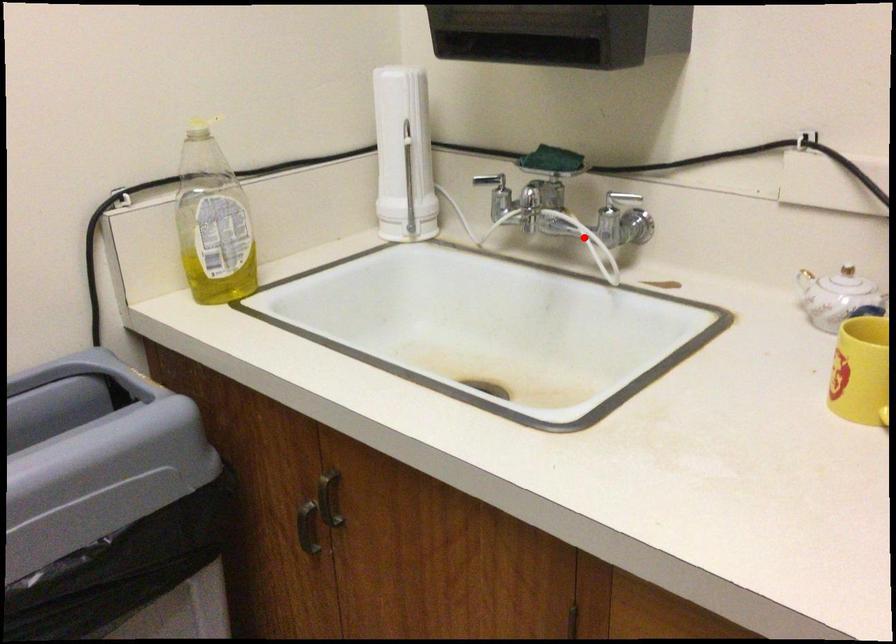
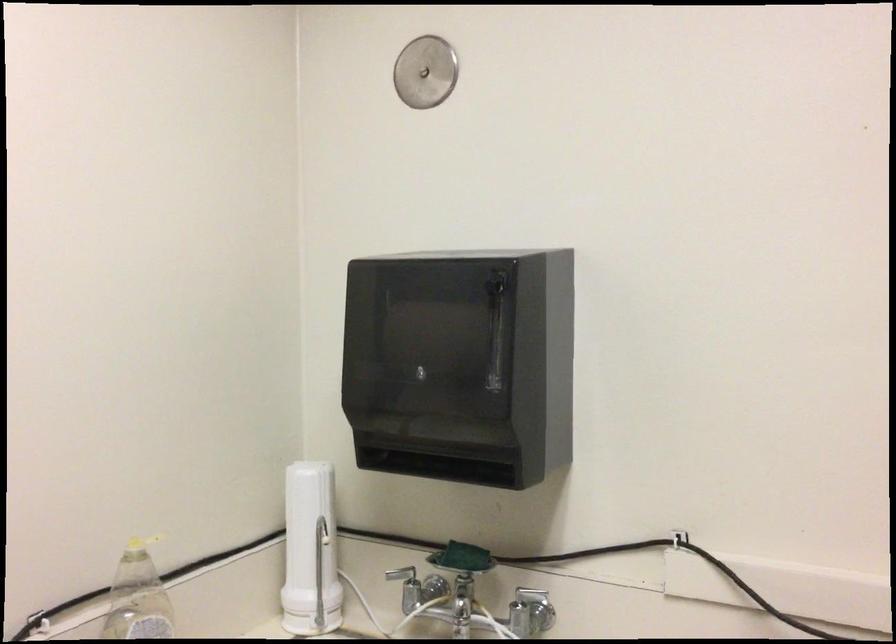
Question: A red point is marked in image1. In image2, is the corresponding 3D point closer to the camera or farther? Reply with the corresponding letter.

Choices:
 (A) The corresponding 3D point is closer.
 (B) The corresponding 3D point is farther.

Answer: (B)